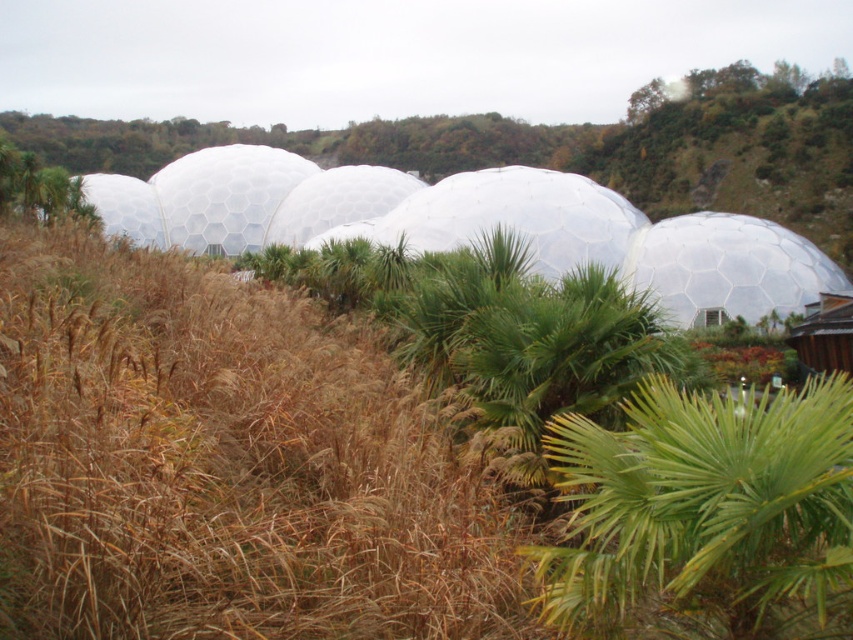
You are a visitor standing in the botanical garden and want to take a photo of the green leafy palm at center without the transparent plastic dome at right appearing in the background. Is this possible given their positions?

The green leafy palm at center is located below the transparent plastic dome at right, so if you position yourself so that the dome is above the palm in your frame, you can avoid including the dome in the background of your photo.

You are a gardener who needs to plant a new tree that requires a lot of sunlight. You see the green leafy palm at center and the transparent plastic dome at right. Which location would provide more sunlight for the new tree?

The transparent plastic dome at right would provide more sunlight for the new tree because the green leafy palm at center is smaller and may block some sunlight, while the dome allows light to pass through its transparent surface.